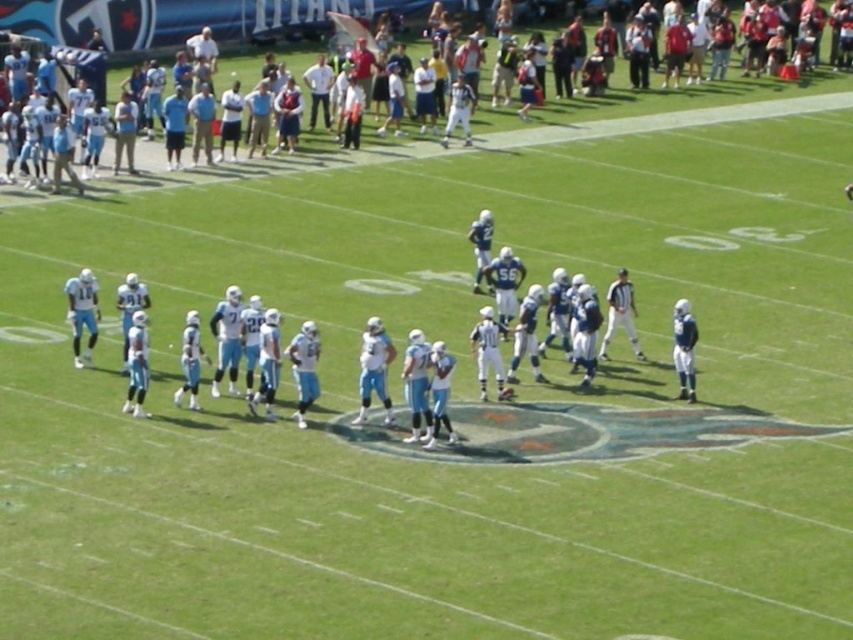
You are a photographer at the football game. You want to take a photo of the light blue fabric football team at center and the light blue jersey at center. Which one appears narrower in the photo?

The light blue fabric football team at center is thinner than the light blue jersey at center, so it will appear narrower in the photo.

You are a photographer standing at the edge of the football field. You want to take a photo that includes both the point at position (254, 248) and the point at position (387, 8). Which point will appear closer to the camera in the photo?

Point (254, 248) is closer to the viewer than point (387, 8), so it will appear closer to the camera in the photo.

You are a spectator at the football game and want to take a photo of the light blue fabric football team at center. Based on their position, where should you aim your camera to capture them clearly?

The light blue fabric football team at center is located at point (494, 390), so you should aim your camera at those coordinates to capture them clearly.